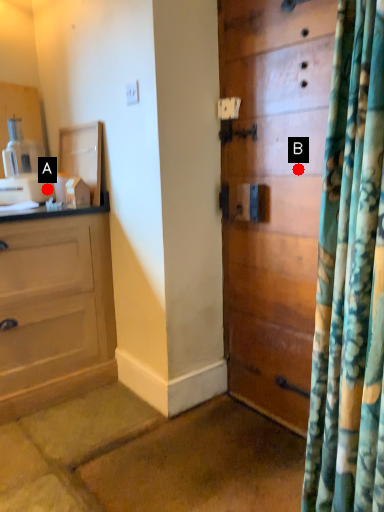
Question: Two points are circled on the image, labeled by A and B beside each circle. Which of the following is the closest to the observer?

Choices:
 (A) A is closer
 (B) B is closer

Answer: (B)